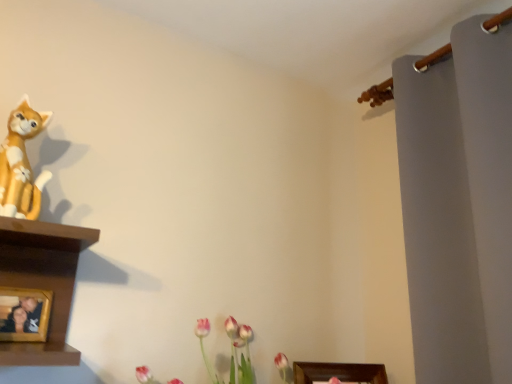
Question: Is wooden photo frame at lower left positioned far away from matte orange cat at left?

Choices:
 (A) yes
 (B) no

Answer: (B)

Question: Is wooden photo frame at lower left closer to the viewer compared to matte orange cat at left?

Choices:
 (A) no
 (B) yes

Answer: (A)

Question: Is wooden photo frame at lower left further to camera compared to matte orange cat at left?

Choices:
 (A) no
 (B) yes

Answer: (B)

Question: Could you tell me if wooden photo frame at lower left is facing matte orange cat at left?

Choices:
 (A) no
 (B) yes

Answer: (A)

Question: Is wooden photo frame at lower left at the left side of matte orange cat at left?

Choices:
 (A) yes
 (B) no

Answer: (A)

Question: Does wooden photo frame at lower left have a larger size compared to matte orange cat at left?

Choices:
 (A) no
 (B) yes

Answer: (A)

Question: Can you confirm if matte orange cat at left is bigger than wooden photo frame at lower left?

Choices:
 (A) yes
 (B) no

Answer: (A)

Question: Is matte orange cat at left facing away from wooden photo frame at lower left?

Choices:
 (A) yes
 (B) no

Answer: (B)

Question: Is the depth of matte orange cat at left greater than that of wooden photo frame at lower left?

Choices:
 (A) yes
 (B) no

Answer: (B)

Question: Is matte orange cat at left far from wooden photo frame at lower left?

Choices:
 (A) no
 (B) yes

Answer: (A)

Question: Is the surface of matte orange cat at left in direct contact with wooden photo frame at lower left?

Choices:
 (A) no
 (B) yes

Answer: (A)

Question: Can you confirm if matte orange cat at left is smaller than wooden photo frame at lower left?

Choices:
 (A) no
 (B) yes

Answer: (A)

Question: Visually, is matte orange cat at left positioned to the left or to the right of wooden photo frame at lower left?

Choices:
 (A) left
 (B) right

Answer: (B)